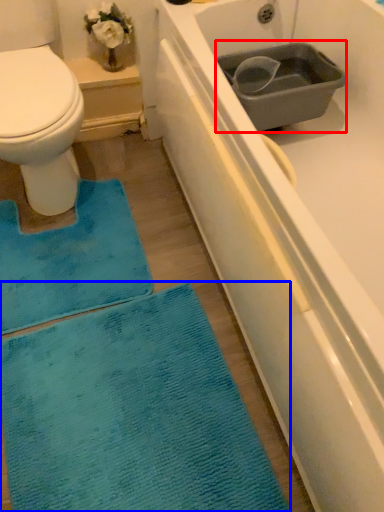
Question: Which object is further to the camera taking this photo, sink (highlighted by a red box) or bath mat (highlighted by a blue box)?

Choices:
 (A) sink
 (B) bath mat

Answer: (A)